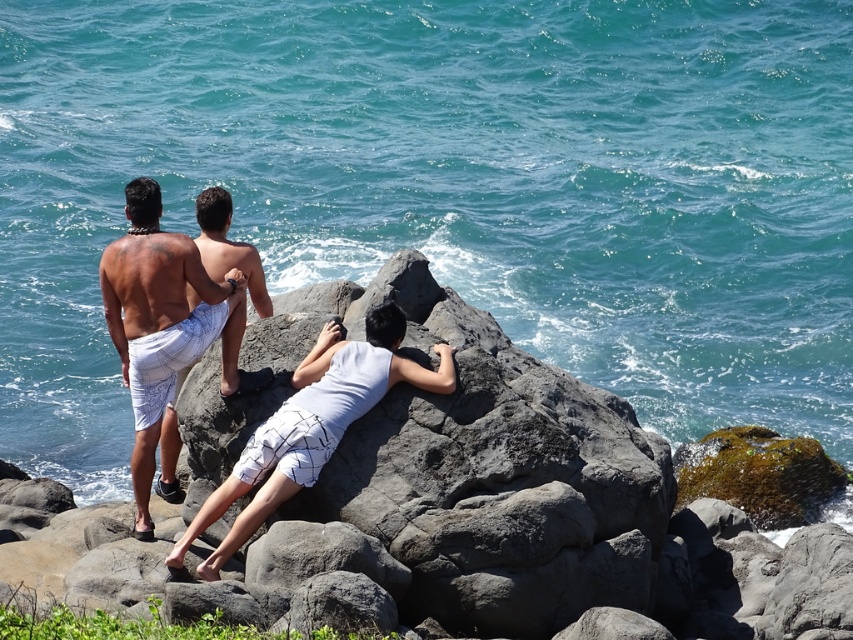
Question: From the image, what is the correct spatial relationship of white printed shorts at left in relation to white textured shorts at center?

Choices:
 (A) left
 (B) right

Answer: (A)

Question: Which object is positioned closest to the white printed shorts at left?

Choices:
 (A) white mesh shorts at center
 (B) gray rough rock at center
 (C) white textured shorts at center

Answer: (C)

Question: Which point is closer to the camera?

Choices:
 (A) white printed shorts at left
 (B) white mesh shorts at center

Answer: (B)

Question: Does white mesh shorts at center have a smaller size compared to white printed shorts at left?

Choices:
 (A) no
 (B) yes

Answer: (B)

Question: Is gray rough rock at center below white printed shorts at left?

Choices:
 (A) no
 (B) yes

Answer: (B)

Question: Which object is closer to the camera taking this photo?

Choices:
 (A) white mesh shorts at center
 (B) white printed shorts at left
 (C) gray rough rock at center
 (D) white textured shorts at center

Answer: (C)